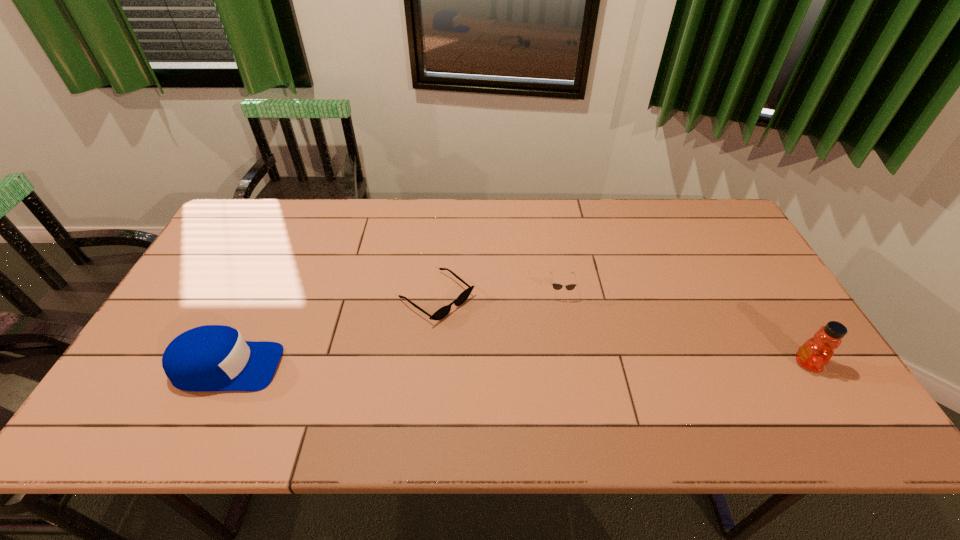
I want to click on vacant point that satisfies the following two spatial constraints: 1. on the back side of the third object from right to left; 2. on the right side of the right sunglasses, so click(438, 292).